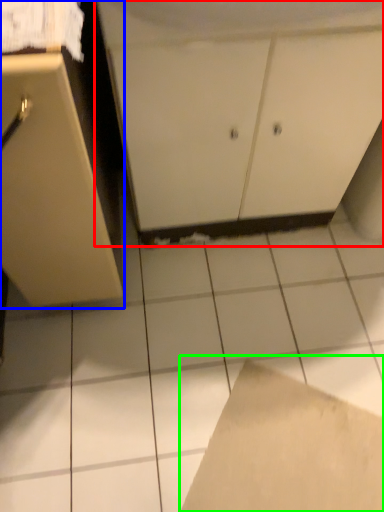
Question: Which is farther away from cabinetry (highlighted by a red box)? cabinetry (highlighted by a blue box) or cardboard (highlighted by a green box)?

Choices:
 (A) cabinetry
 (B) cardboard

Answer: (B)